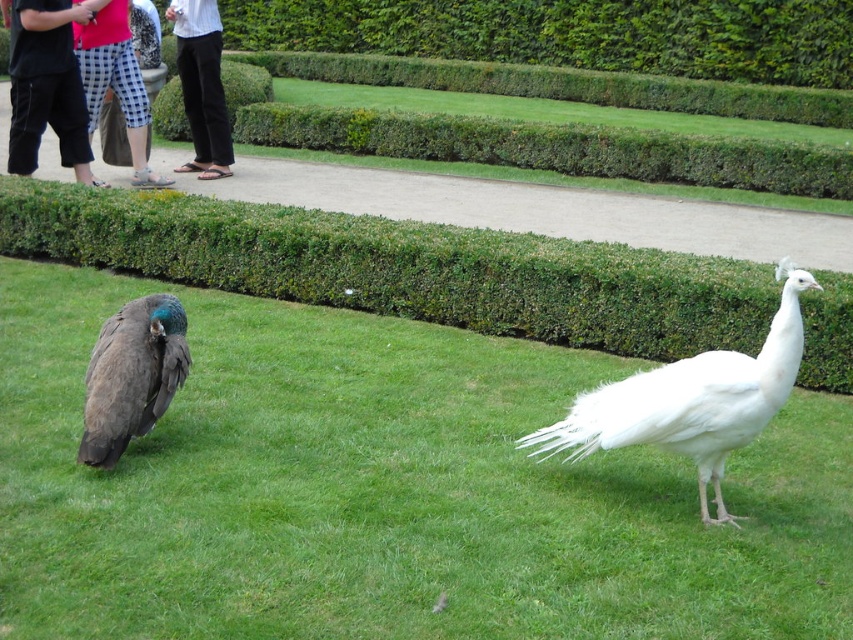
Does green grass at center have a larger size compared to checkered fabric pants at left?

Yes, green grass at center is bigger than checkered fabric pants at left.

Can you confirm if green grass at center is shorter than checkered fabric pants at left?

Indeed, green grass at center has a lesser height compared to checkered fabric pants at left.

Image resolution: width=853 pixels, height=640 pixels. Find the location of `green grass at center`. green grass at center is located at coordinates (386, 490).

Locate an element on the screen. This screenshot has width=853, height=640. green grass at center is located at coordinates (386, 490).

Does white feathered peacock at center appear over black pants at left?

No, white feathered peacock at center is not above black pants at left.

Who is positioned more to the left, white feathered peacock at center or black pants at left?

black pants at left is more to the left.

Is point (573, 456) positioned in front of point (20, 56)?

Yes.

I want to click on white feathered peacock at center, so click(691, 401).

Can you confirm if checkered fabric pants at left is positioned above black pants at upper left?

No.

Does point (140, 83) lie in front of point (201, 42)?

Yes.

Where is `checkered fabric pants at left`? This screenshot has width=853, height=640. checkered fabric pants at left is located at coordinates (114, 77).